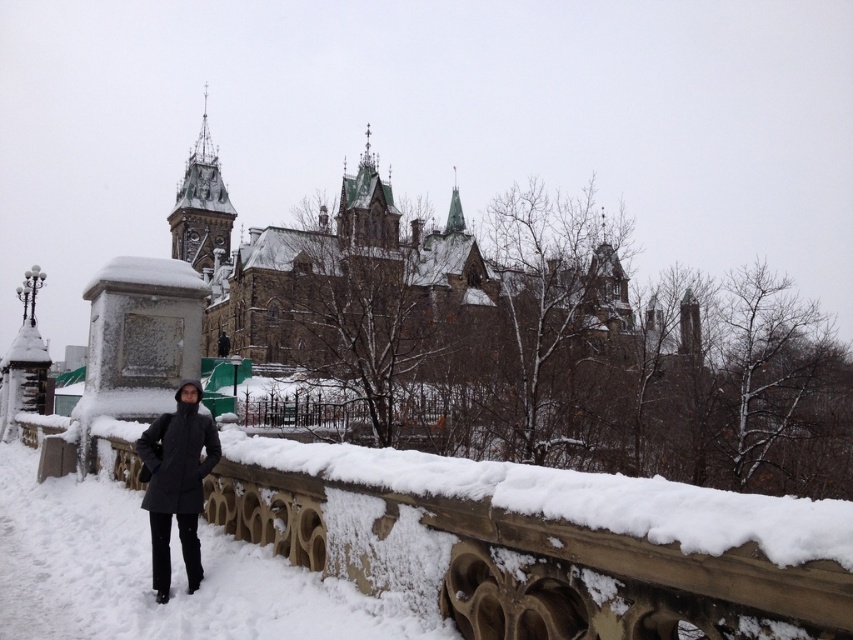
You are a photographer trying to capture the grand building in the background while standing on the snow path. To avoid blocking the view of the sanded stone balustrade at lower left, where should you position yourself relative to it?

The sanded stone balustrade at lower left is located at point (543,541), so you should position yourself to the right of the sanded stone balustrade at lower left to ensure the balustrade is visible in the foreground without blocking the grand building in the background.

You are standing at the point with coordinates point [164,509] and want to walk to the grand historic building in the background. Which direction should you move relative to point [398,483]?

You should move away from point [398,483] because point [398,483] is in front of point [164,509], meaning that point [164,509] is behind point [398,483]. To reach the grand historic building in the background, you need to move in the direction away from point [398,483].

You are a photographer trying to capture a shot of the dark gray coat at center and the sanded stone balustrade at lower left. Which object is positioned closer to the camera?

The sanded stone balustrade at lower left is closer to the viewer than the dark gray coat at center, so it will appear in front in the photograph.